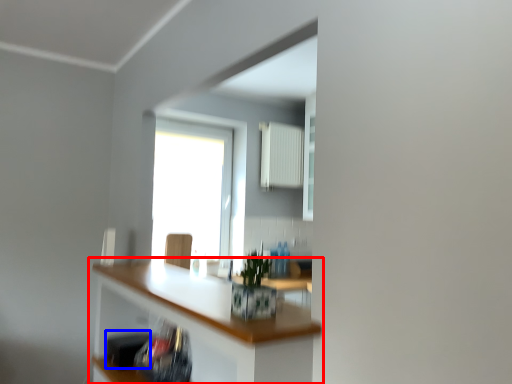
Question: Which object appears closest to the camera in this image, countertop (highlighted by a red box) or appliance (highlighted by a blue box)?

Choices:
 (A) countertop
 (B) appliance

Answer: (A)